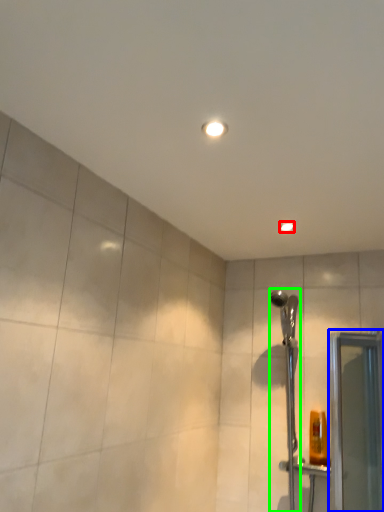
Question: Which object is positioned farthest from light fixture (highlighted by a red box)? Select from screen door (highlighted by a blue box) and shower (highlighted by a green box).

Choices:
 (A) screen door
 (B) shower

Answer: (A)